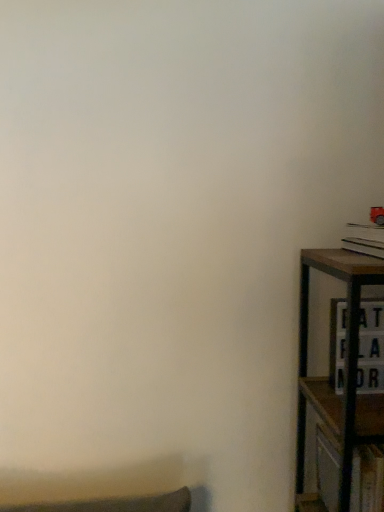
Question: Is hardcover book at right wider than wooden cabinet at right?

Choices:
 (A) no
 (B) yes

Answer: (B)

Question: From a real-world perspective, is hardcover book at right below wooden cabinet at right?

Choices:
 (A) yes
 (B) no

Answer: (B)

Question: Would you say hardcover book at right contains wooden cabinet at right?

Choices:
 (A) yes
 (B) no

Answer: (B)

Question: Is hardcover book at right positioned with its back to wooden cabinet at right?

Choices:
 (A) yes
 (B) no

Answer: (B)

Question: Does hardcover book at right appear on the left side of wooden cabinet at right?

Choices:
 (A) yes
 (B) no

Answer: (B)

Question: From the image's perspective, does hardcover book at right appear higher than wooden cabinet at right?

Choices:
 (A) yes
 (B) no

Answer: (A)

Question: Does wooden cabinet at right appear on the left side of hardcover book at right?

Choices:
 (A) no
 (B) yes

Answer: (B)

Question: From the image's perspective, would you say wooden cabinet at right is shown under hardcover book at right?

Choices:
 (A) no
 (B) yes

Answer: (B)

Question: Can you confirm if wooden cabinet at right is shorter than hardcover book at right?

Choices:
 (A) no
 (B) yes

Answer: (A)

Question: Is wooden cabinet at right taller than hardcover book at right?

Choices:
 (A) no
 (B) yes

Answer: (B)

Question: Is wooden cabinet at right not close to hardcover book at right?

Choices:
 (A) yes
 (B) no

Answer: (B)

Question: Considering the relative sizes of wooden cabinet at right and hardcover book at right in the image provided, is wooden cabinet at right smaller than hardcover book at right?

Choices:
 (A) yes
 (B) no

Answer: (B)

Question: Is wooden cabinet at right wider or thinner than hardcover book at right?

Choices:
 (A) wide
 (B) thin

Answer: (B)